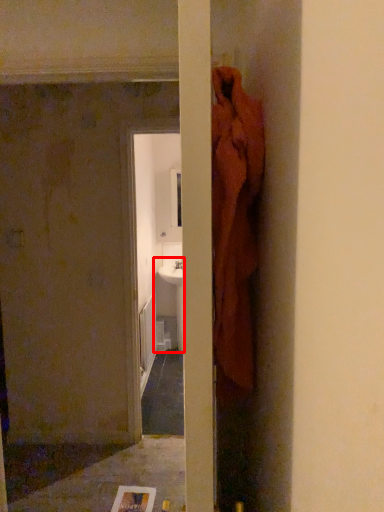
Question: Considering the relative positions of sink (annotated by the red box) and concrete in the image provided, where is sink (annotated by the red box) located with respect to the staircase?

Choices:
 (A) left
 (B) right

Answer: (B)